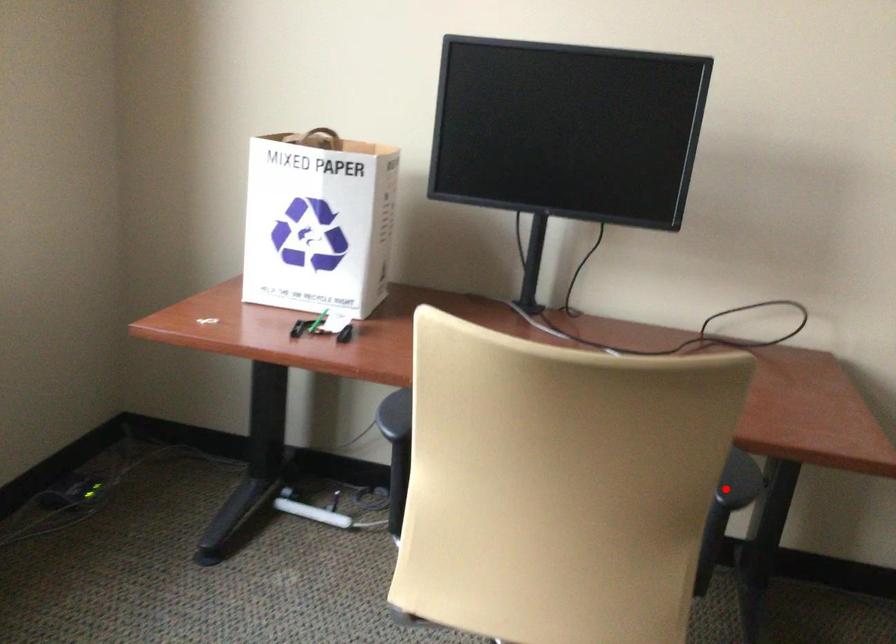
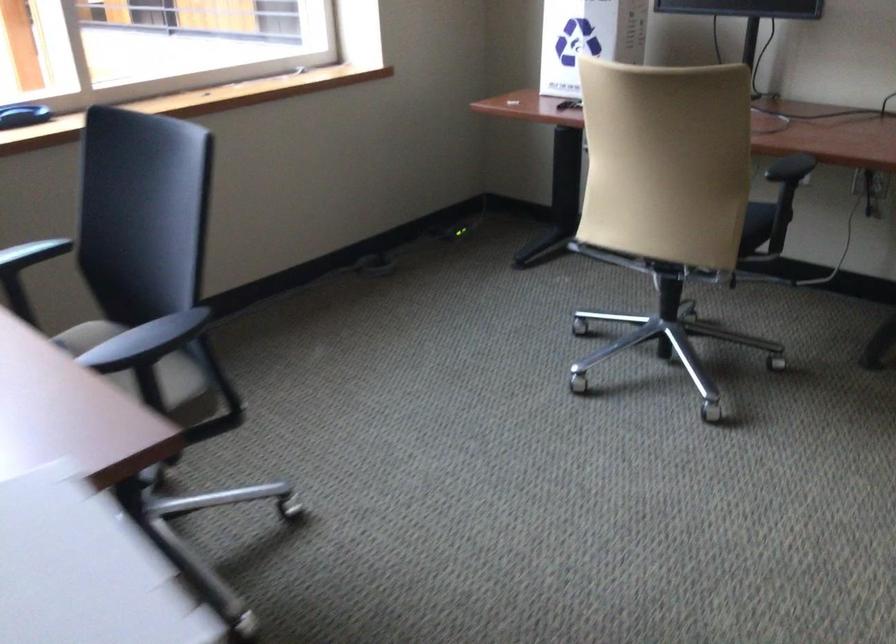
Locate, in the second image, the point that corresponds to the highlighted location in the first image.

(790, 167)